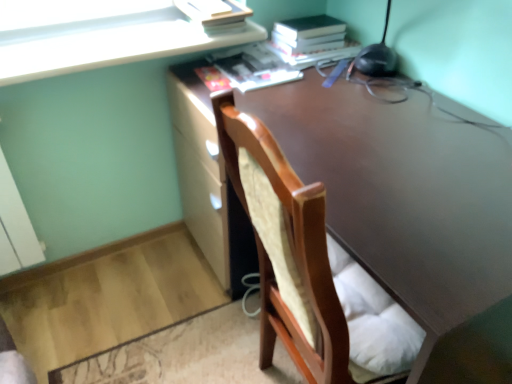
I want to click on vacant space situated above matte yellow paperback book at upper center, which ranks as the 2th paperback book in right-to-left order (from a real-world perspective), so click(x=221, y=1).